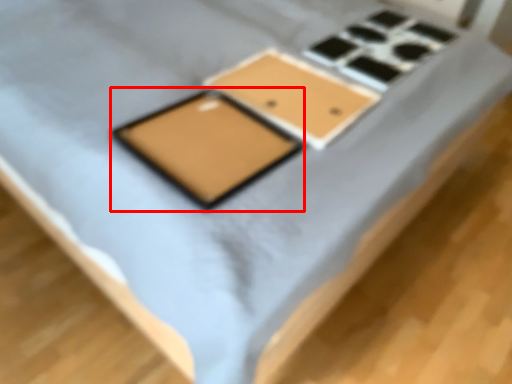
Question: Considering the relative positions of tablet computer (annotated by the red box) and rectangle in the image provided, where is tablet computer (annotated by the red box) located with respect to the staircase?

Choices:
 (A) left
 (B) right

Answer: (A)